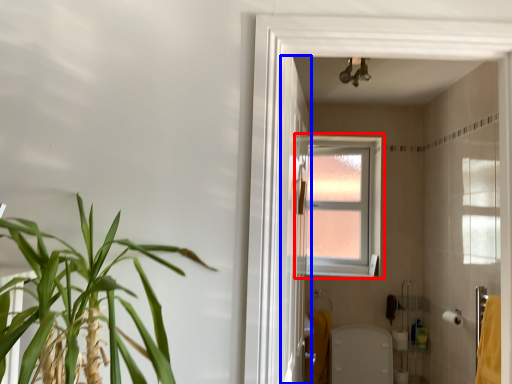
Question: Which of the following is the closest to the observer, window (highlighted by a red box) or screen door (highlighted by a blue box)?

Choices:
 (A) window
 (B) screen door

Answer: (B)